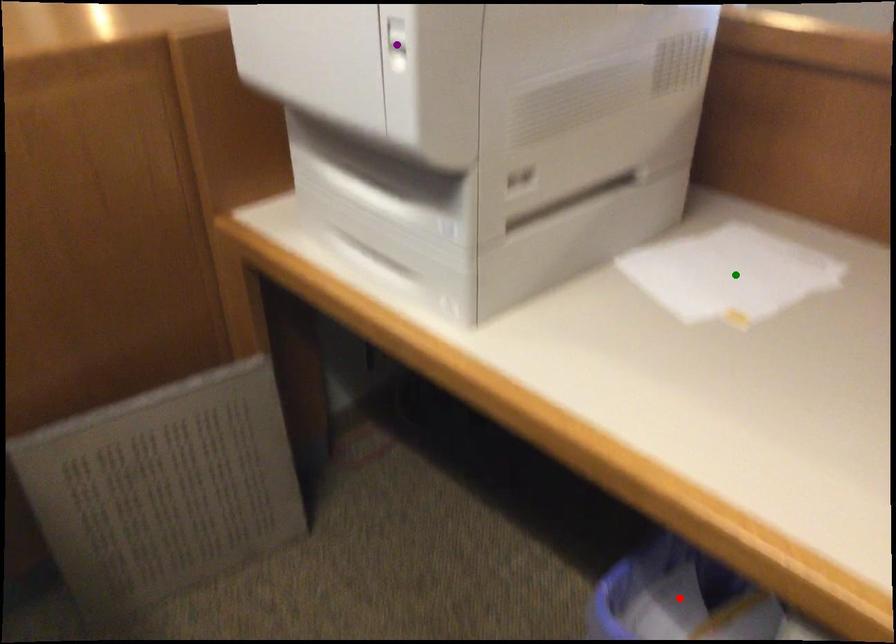
Based on the photo, order these from nearest to farthest:
green point
red point
purple point

1. purple point
2. red point
3. green point